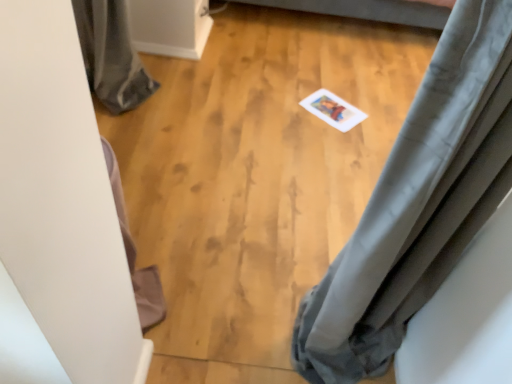
Where is `unoccupied region to the right of white paper at center`? unoccupied region to the right of white paper at center is located at coordinates (380, 119).